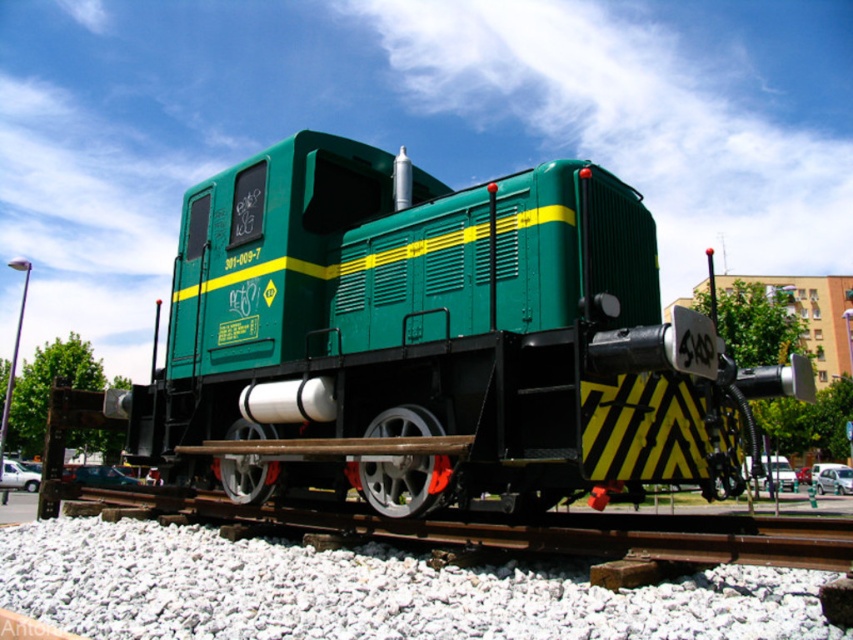
Does white gravel at lower center have a larger size compared to smooth metal train track at center?

Yes.

Who is shorter, white gravel at lower center or smooth metal train track at center?

white gravel at lower center is shorter.

In order to click on white gravel at lower center in this screenshot , I will do `click(366, 592)`.

Is green matte train at center smaller than smooth metal train track at center?

Actually, green matte train at center might be larger than smooth metal train track at center.

Is green matte train at center to the right of smooth metal train track at center from the viewer's perspective?

Incorrect, green matte train at center is not on the right side of smooth metal train track at center.

Is point (346, 221) in front of point (833, 531)?

No.

I want to click on green matte train at center, so click(434, 340).

Is point (315, 381) less distant than point (173, 566)?

No, (315, 381) is further to viewer.

Is green matte train at center shorter than white gravel at lower center?

Incorrect, green matte train at center's height does not fall short of white gravel at lower center's.

The width and height of the screenshot is (853, 640). I want to click on green matte train at center, so click(434, 340).

At what (x,y) coordinates should I click in order to perform the action: click on green matte train at center. Please return your answer as a coordinate pair (x, y). The height and width of the screenshot is (640, 853). Looking at the image, I should click on (434, 340).